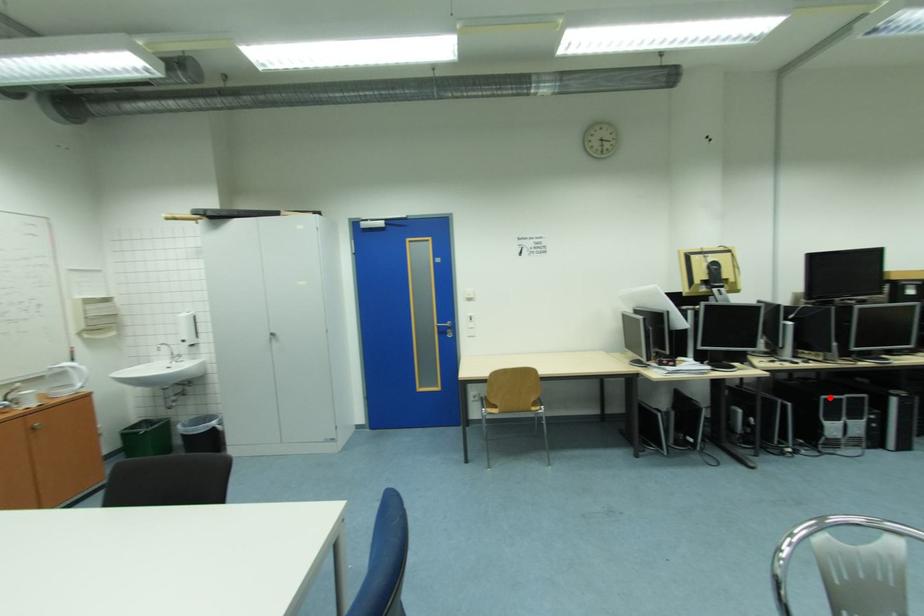
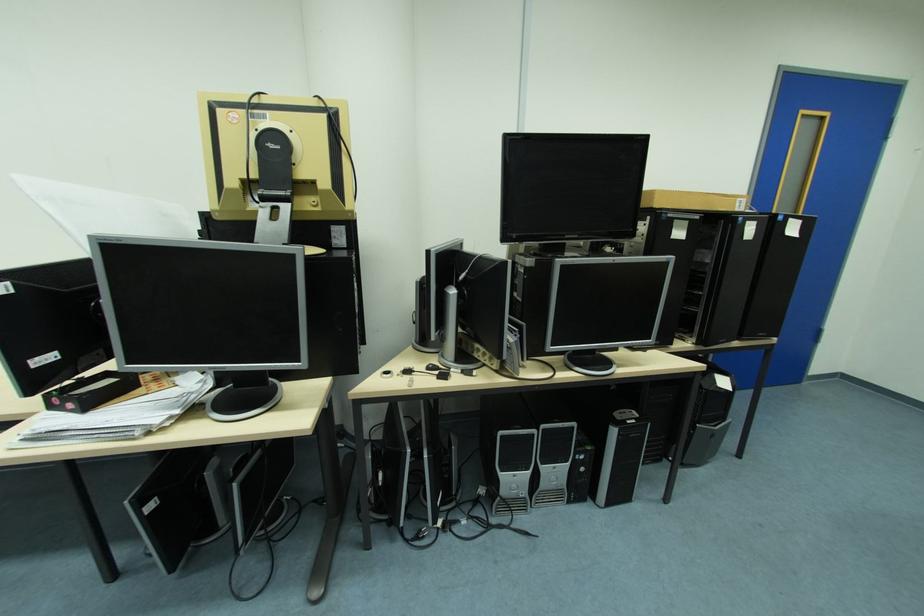
Where in the second image is the point corresponding to the highlighted location from the first image?

(507, 434)